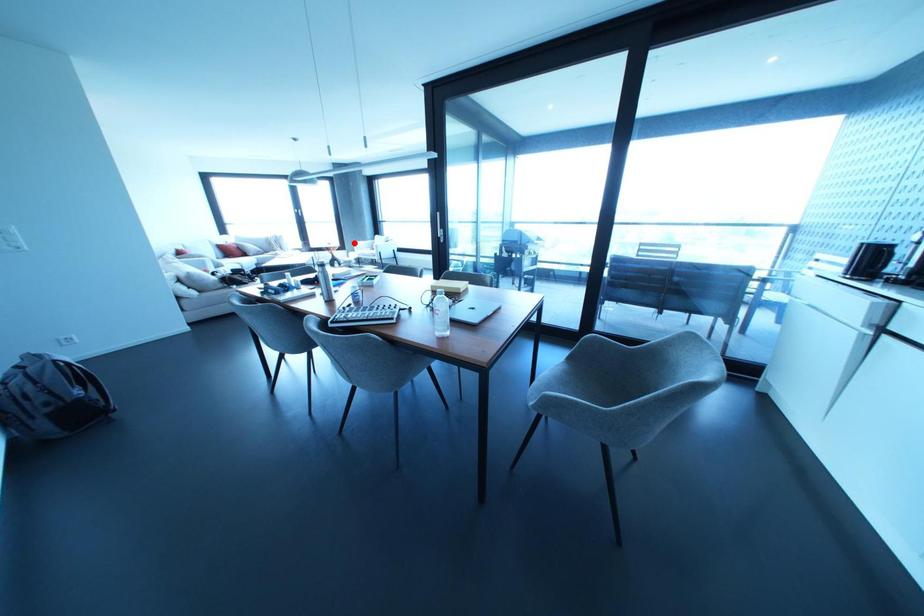
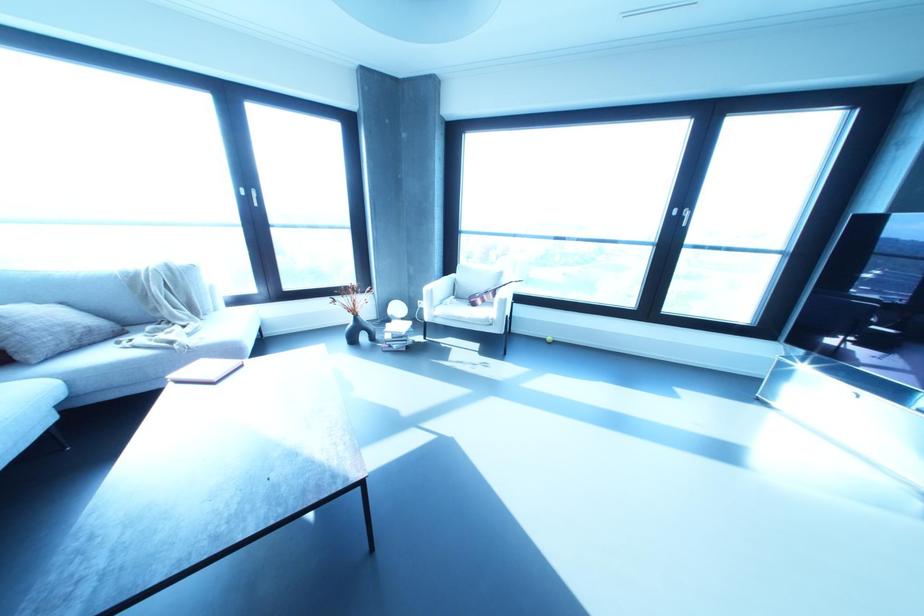
Question: I am providing you with two images of the same scene from different viewpoints. A red point is marked on the first image. At the location where the point appears in image 1, is it still visible in image 2?

Choices:
 (A) Yes
 (B) No

Answer: (A)